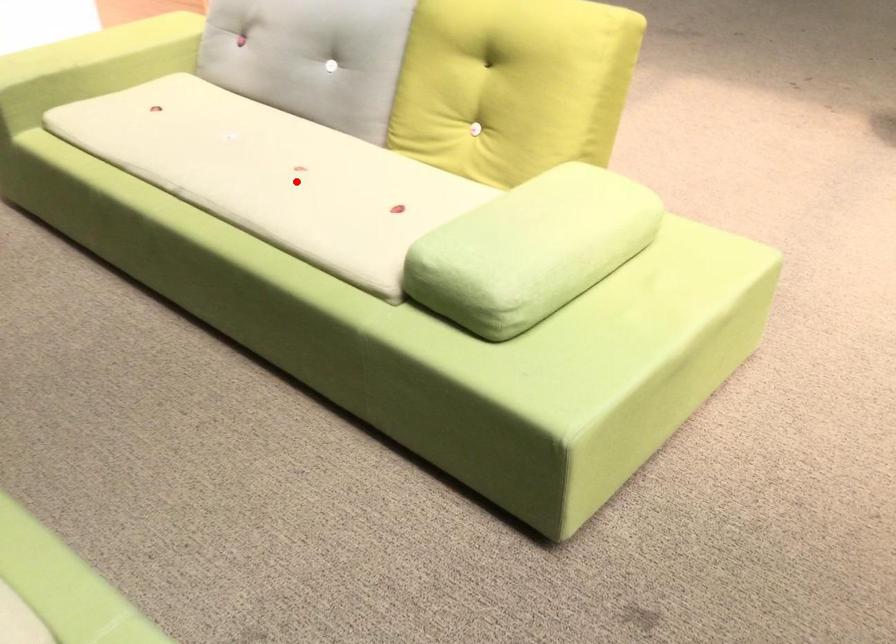
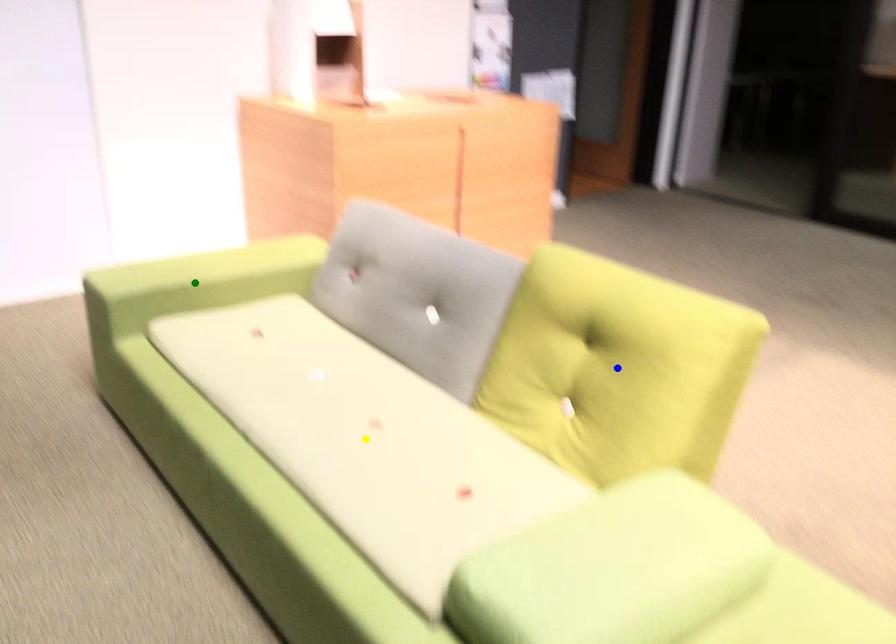
Question: I am providing you with two images of the same scene from different viewpoints. A red point is marked on the first image. You are given multiple points on the second image. Which spot in image 2 lines up with the point in image 1?

Choices:
 (A) green point
 (B) blue point
 (C) yellow point

Answer: (C)